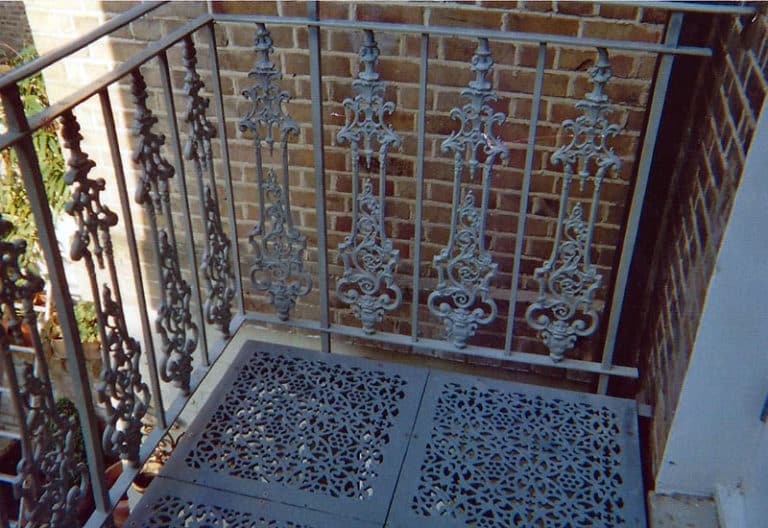
Identify the location of white wood. The width and height of the screenshot is (768, 528). (733, 367).